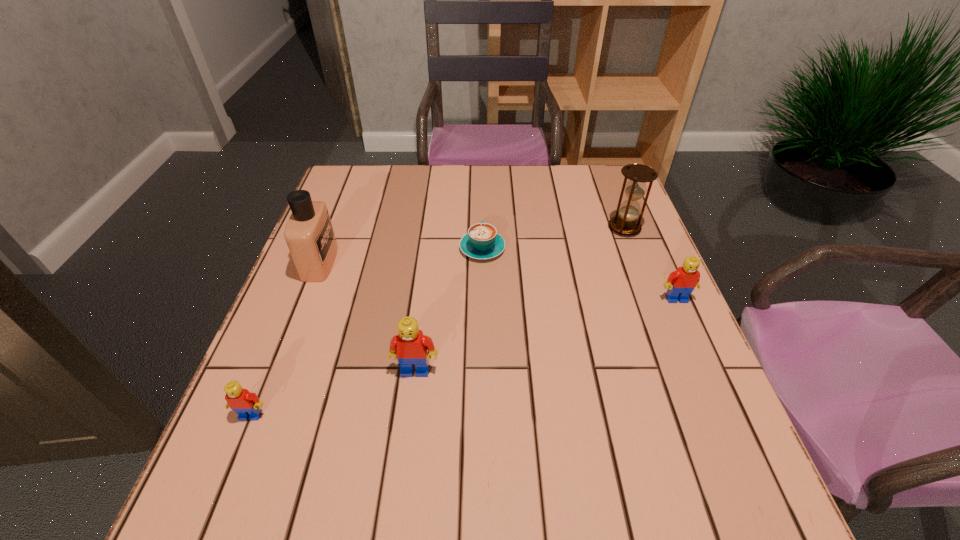
Image resolution: width=960 pixels, height=540 pixels. I want to click on the leftmost Lego, so click(246, 404).

Where is `the nearest object`? The image size is (960, 540). the nearest object is located at coordinates (246, 404).

Identify the location of the third tallest object. The image size is (960, 540). (410, 346).

Identify the location of the fourth object from right to left. (410, 346).

Locate an element on the screen. the second shortest Lego is located at coordinates point(681,283).

Find the location of a particular element. The image size is (960, 540). the fourth farthest object is located at coordinates (681, 283).

This screenshot has height=540, width=960. I want to click on the fourth object from left to right, so [482, 241].

Where is `the shortest object`? the shortest object is located at coordinates (482, 241).

The height and width of the screenshot is (540, 960). In order to click on hourglass in this screenshot , I will do `click(626, 223)`.

Identify the location of perfume. The width and height of the screenshot is (960, 540). (309, 234).